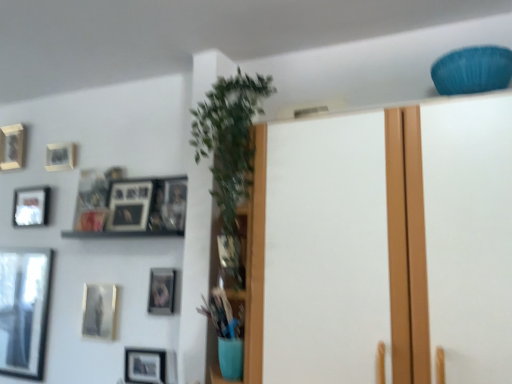
Question: Is matte gold picture frame at upper left, the 5th picture frame positioned from the right, oriented towards matte gold picture frame at center-left, acting as the 8th picture frame starting from the left?

Choices:
 (A) no
 (B) yes

Answer: (A)

Question: Does matte gold picture frame at upper left, the 5th picture frame positioned from the right, come behind matte gold picture frame at center-left, acting as the 8th picture frame starting from the left?

Choices:
 (A) no
 (B) yes

Answer: (B)

Question: From a real-world perspective, is matte gold picture frame at upper left, the 5th picture frame positioned from the right, beneath matte gold picture frame at center-left, acting as the 8th picture frame starting from the left?

Choices:
 (A) no
 (B) yes

Answer: (A)

Question: From the image's perspective, would you say matte gold picture frame at upper left, the fourth picture frame in the left-to-right sequence, is shown under matte gold picture frame at center-left, acting as the 8th picture frame starting from the left?

Choices:
 (A) no
 (B) yes

Answer: (A)

Question: Does matte gold picture frame at upper left, the fourth picture frame in the left-to-right sequence, have a lesser width compared to matte gold picture frame at center-left, acting as the 8th picture frame starting from the left?

Choices:
 (A) no
 (B) yes

Answer: (A)

Question: Considering their positions, is matte black picture frame at lower center, marked as the 2th picture frame in a right-to-left arrangement, located in front of or behind matte black picture frame at lower left, positioned as the 3th picture frame in right-to-left order?

Choices:
 (A) front
 (B) behind

Answer: (A)

Question: Looking at their shapes, would you say matte black picture frame at lower center, marked as the 2th picture frame in a right-to-left arrangement, is wider or thinner than matte black picture frame at lower left, positioned as the 3th picture frame in right-to-left order?

Choices:
 (A) wide
 (B) thin

Answer: (A)

Question: Based on their sizes in the image, would you say matte black picture frame at lower center, marked as the 2th picture frame in a right-to-left arrangement, is bigger or smaller than matte black picture frame at lower left, positioned as the 3th picture frame in right-to-left order?

Choices:
 (A) small
 (B) big

Answer: (B)

Question: From the image's perspective, is matte black picture frame at lower center, marked as the seventh picture frame in a left-to-right arrangement, located above or below matte black picture frame at lower left, positioned as the 3th picture frame in right-to-left order?

Choices:
 (A) above
 (B) below

Answer: (B)

Question: In terms of height, does white matte door at center look taller or shorter compared to matte black picture frame at lower center, marked as the 2th picture frame in a right-to-left arrangement?

Choices:
 (A) tall
 (B) short

Answer: (A)

Question: Based on their positions, is white matte door at center located to the left or right of matte black picture frame at lower center, marked as the 2th picture frame in a right-to-left arrangement?

Choices:
 (A) right
 (B) left

Answer: (A)

Question: Is white matte door at center situated inside matte black picture frame at lower center, marked as the seventh picture frame in a left-to-right arrangement, or outside?

Choices:
 (A) inside
 (B) outside

Answer: (B)

Question: Does point 470,231 appear closer or farther from the camera than point 124,349?

Choices:
 (A) farther
 (B) closer

Answer: (B)

Question: In the image, is matte silver picture frame at upper left, the seventh picture frame when ordered from right to left, positioned in front of or behind matte black picture frame at lower left, positioned as the 3th picture frame in right-to-left order?

Choices:
 (A) front
 (B) behind

Answer: (B)

Question: From a real-world perspective, is matte silver picture frame at upper left, the seventh picture frame when ordered from right to left, above or below matte black picture frame at lower left, the 6th picture frame when ordered from left to right?

Choices:
 (A) above
 (B) below

Answer: (A)